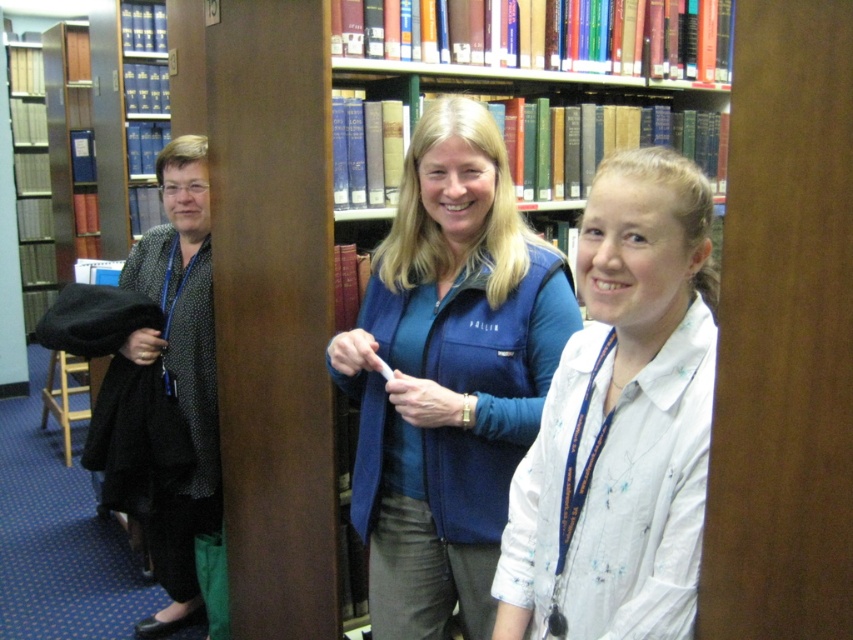
You are a librarian who needs to place a new book on the shelf. The book is as wide as the black dotted blouse at left. Can the wooden bookcase at center accommodate this book?

The wooden bookcase at center has a width that surpasses the black dotted blouse at left, so the book should fit on the wooden bookcase at center.

What is located at the coordinates point [621,422]?

The white cotton shirt at center is located at point [621,422].

You are a visitor in the library and you see the white cotton shirt at center and the wooden bookcase at center. Which one is positioned to the right side from your perspective?

The white cotton shirt at center is positioned to the right of the wooden bookcase at center, so the white cotton shirt at center is on the right side.